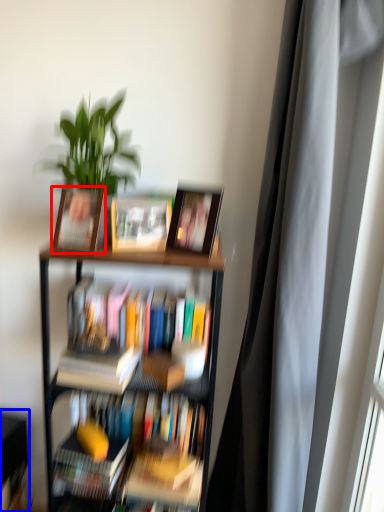
Question: Among these objects, which one is nearest to the camera, picture frame (highlighted by a red box) or shelf (highlighted by a blue box)?

Choices:
 (A) picture frame
 (B) shelf

Answer: (A)